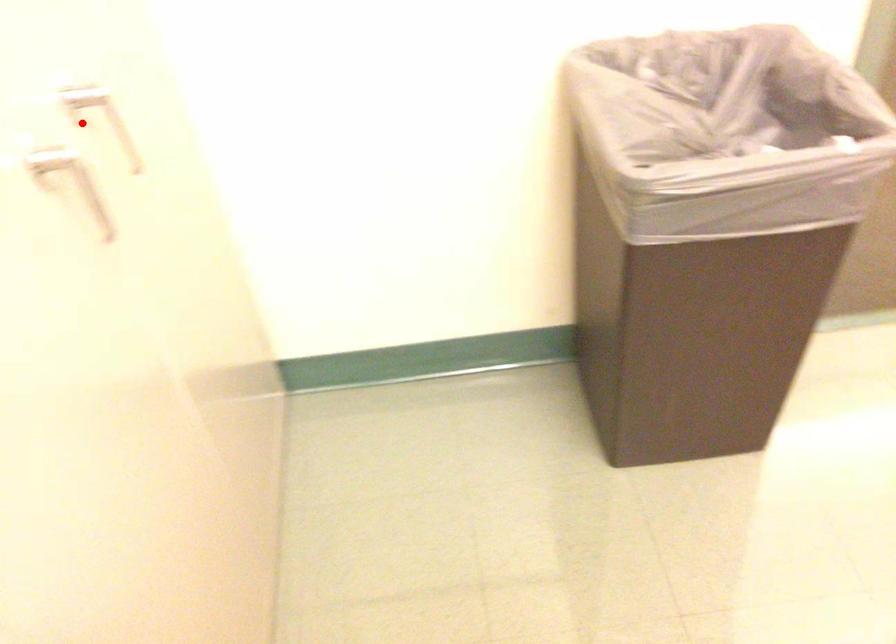
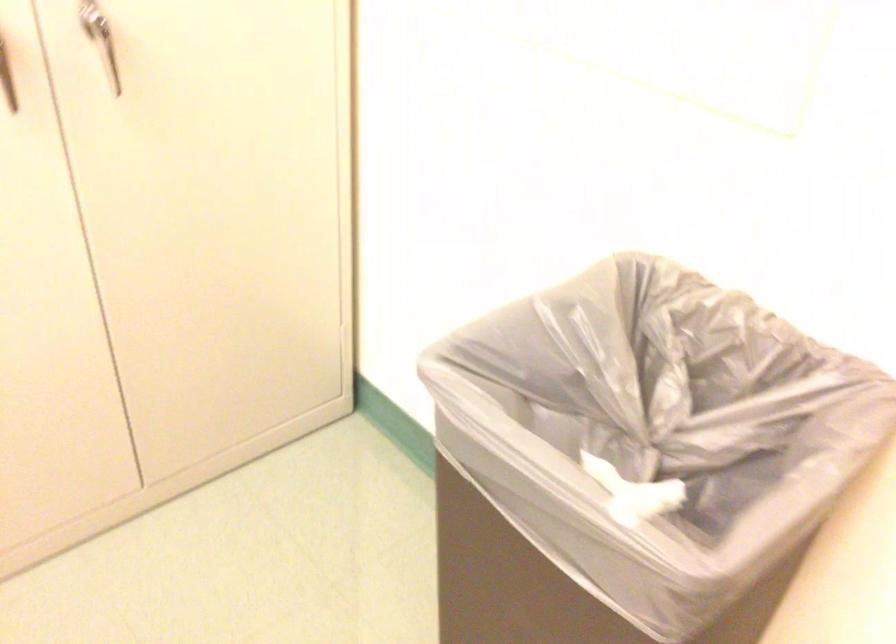
Question: I am providing you with two images of the same scene from different viewpoints. Image1 has a red point marked. In image2, the corresponding 3D location appears at what relative position? Reply with the corresponding letter.

Choices:
 (A) Closer
 (B) Farther

Answer: (B)